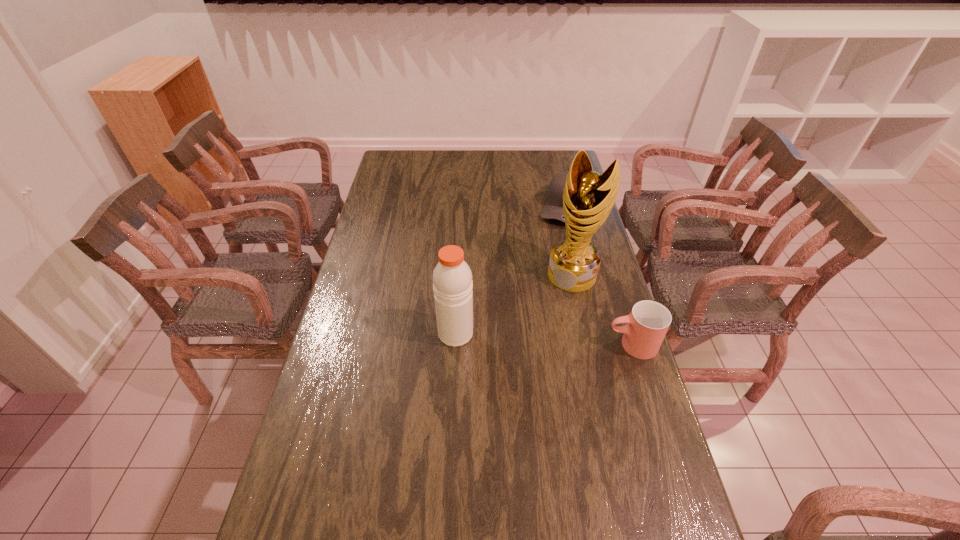
Where is `unoccupied position between the shaker and the award`? The height and width of the screenshot is (540, 960). unoccupied position between the shaker and the award is located at coordinates click(x=515, y=304).

This screenshot has height=540, width=960. I want to click on vacant area between the third shortest object and the second farthest object, so click(515, 304).

Find the location of a particular element. object that is the third closest one to the farthest object is located at coordinates (452, 279).

Locate an element on the screen. object that is the second closest to the third nearest object is located at coordinates (553, 209).

The image size is (960, 540). Identify the location of free space that satisfies the following two spatial constraints: 1. on the front side of the cup; 2. on the side of the second tallest object with the handle. (455, 345).

You are a GUI agent. You are given a task and a screenshot of the screen. Output one action in this format:
    pyautogui.click(x=<x>, y=<y>)
    Task: Click on the free spot that satisfies the following two spatial constraints: 1. on the front side of the cup; 2. on the side of the farthest object with the handle
    Image resolution: width=960 pixels, height=540 pixels.
    Given the screenshot: What is the action you would take?
    pyautogui.click(x=596, y=345)